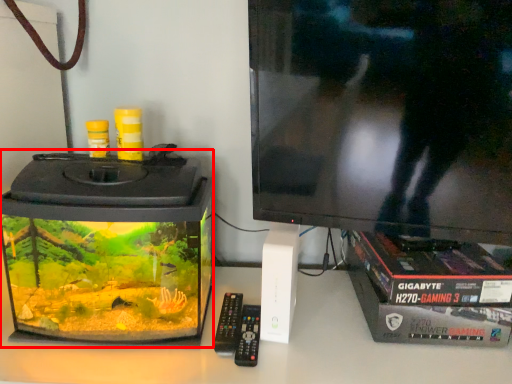
Question: In this image, where is appliance (annotated by the red box) located relative to control?

Choices:
 (A) right
 (B) left

Answer: (B)